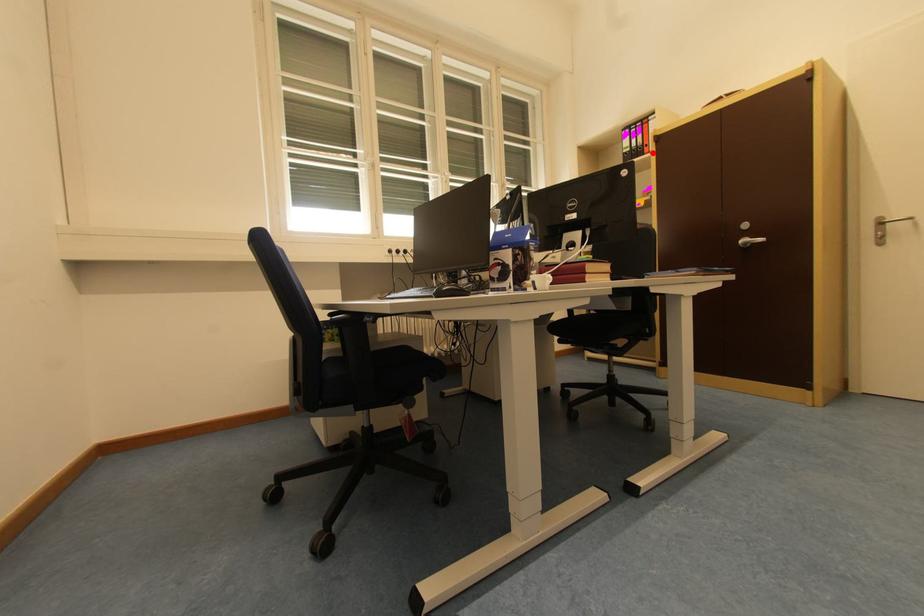
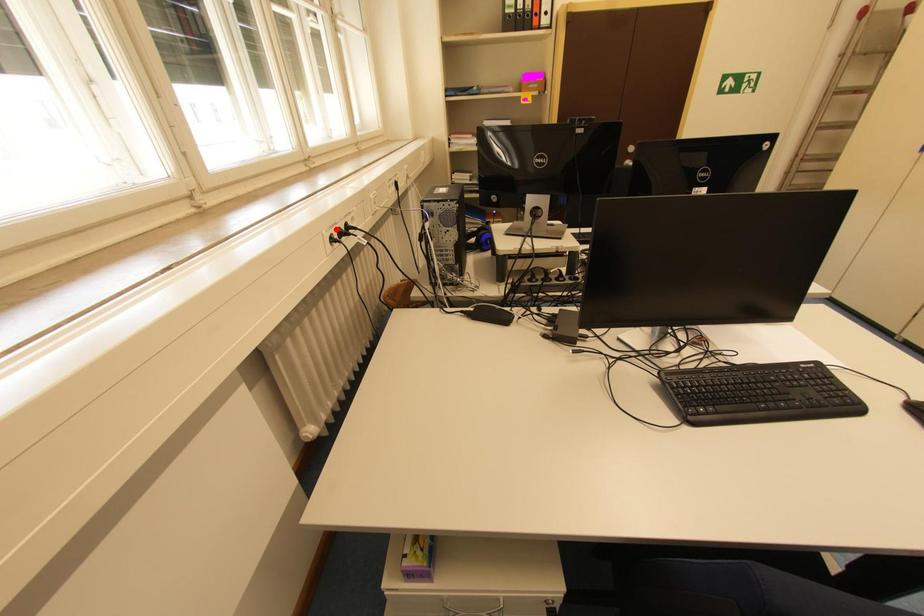
I am providing you with two images of the same scene from different viewpoints. A red point is marked on the first image and another point is marked on the second image. Is the red point in image1 aligned with the point shown in image2?

No